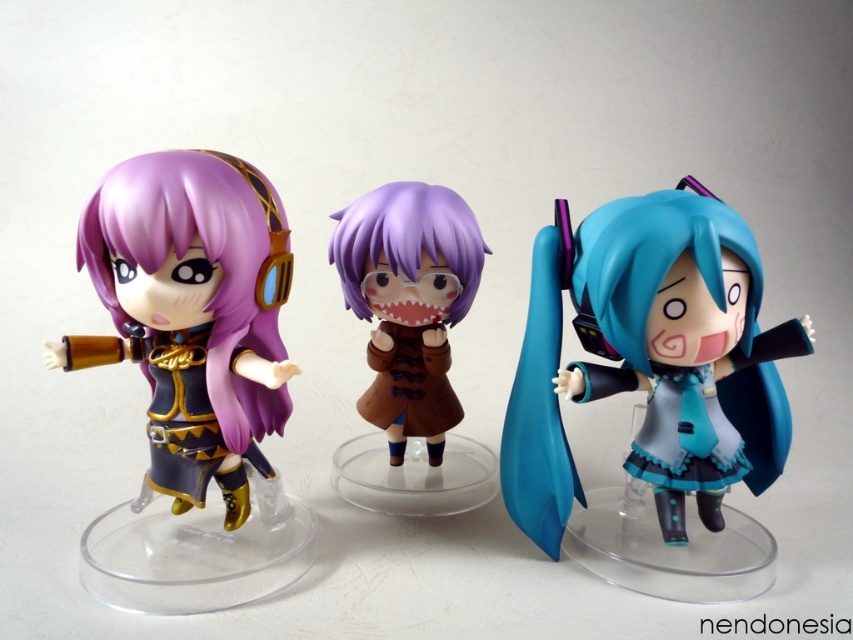
You are organizing a display for a toy store and need to arrange the teal glossy figure at center and the matte purple doll at left based on their sizes. Which one should you place in the front to make the display more visually appealing?

The teal glossy figure at center is larger than the matte purple doll at left, so placing it in the front will create a more visually appealing display.

You are an art curator arranging these dolls on a shelf. The shelf has a width limit of 10 inches. If the matte purple doll at left is 6 inches wide and the purple glossy doll at center is 4 inches wide, will both dolls fit side by side on the shelf without overlapping?

The matte purple doll at left is 6 inches wide and the purple glossy doll at center is 4 inches wide, totaling 10 inches. Since the shelf has a width limit of 10 inches, both dolls can fit side by side without overlapping.